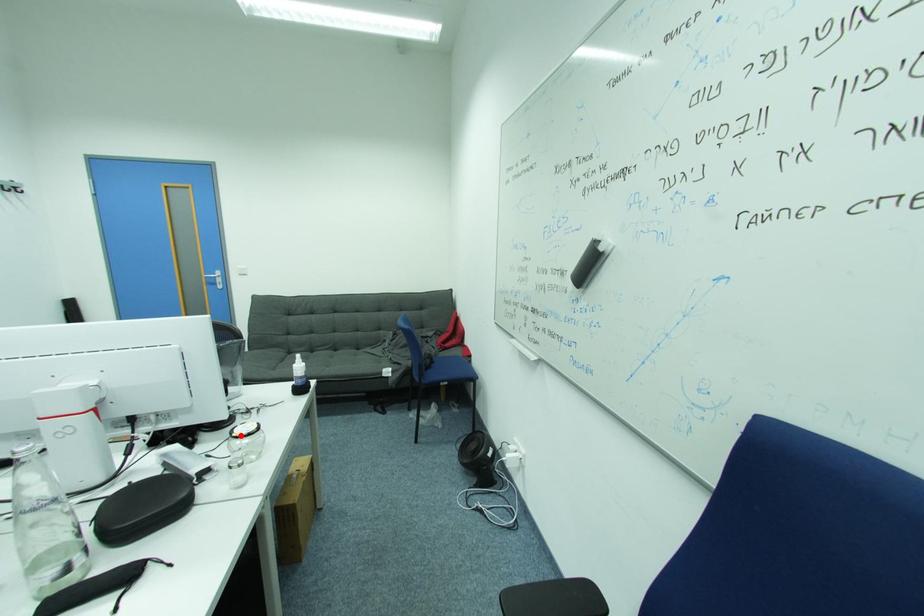
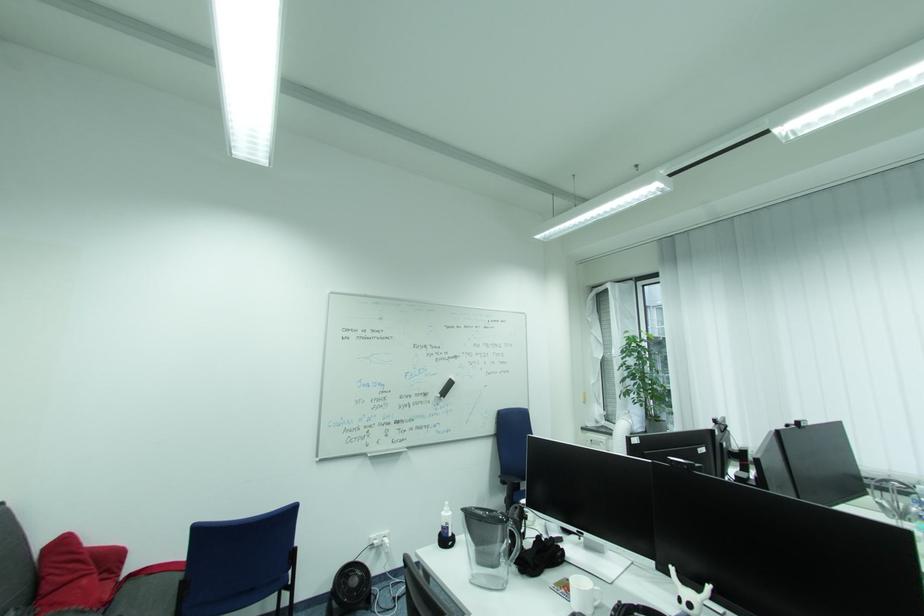
Question: I am providing you with two images of the same scene from different viewpoints. A red point is marked on the first image. Can you still see the location of the red point in image 2?

Choices:
 (A) Yes
 (B) No

Answer: (B)